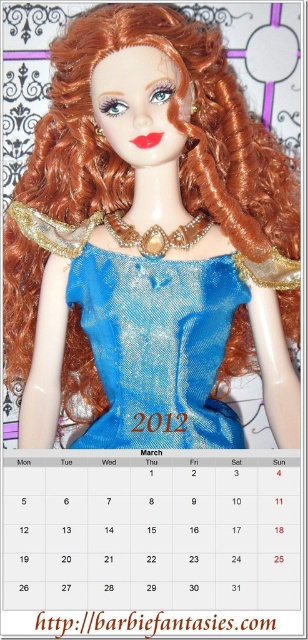
Consider the image. You are a fashion designer looking at two dresses displayed on a mannequin. The shiny blue dress at center and the blue sequined dress at center are both on display. Which dress is located to the left of the other?

The shiny blue dress at center is positioned on the left side of the blue sequined dress at center.